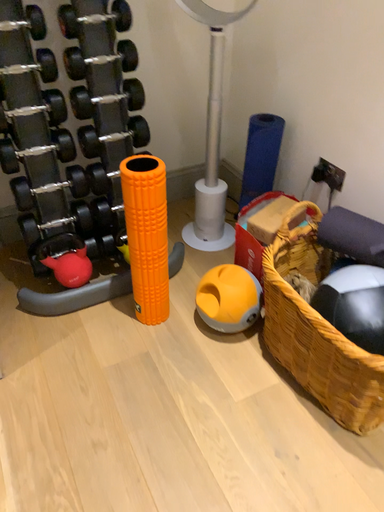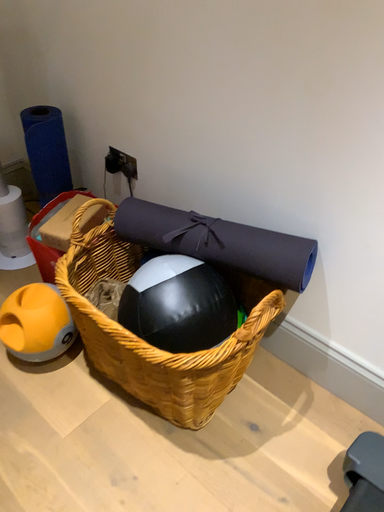
Question: Which way did the camera rotate in the video?

Choices:
 (A) rotated right
 (B) rotated left

Answer: (A)